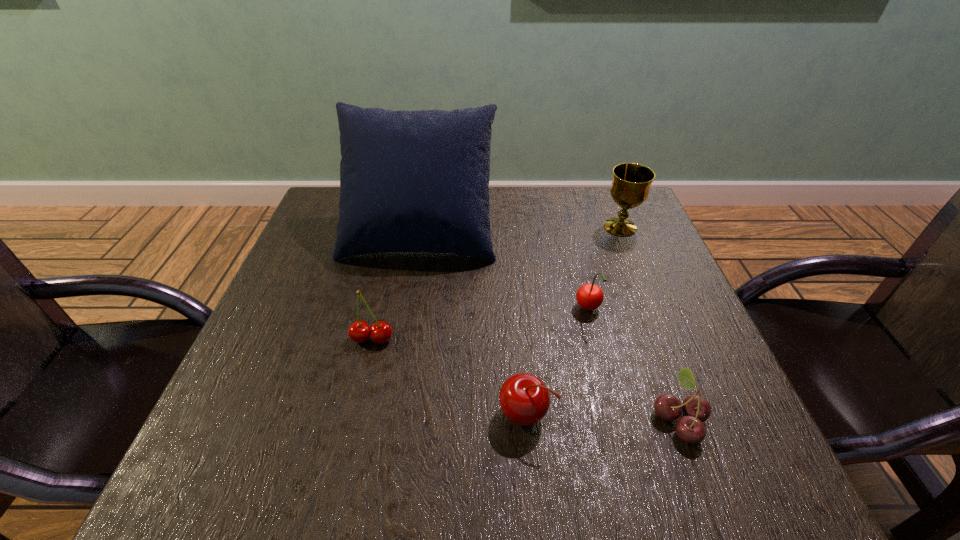
Find the location of a particular element. chalice situated at the right edge is located at coordinates (630, 188).

Where is `cherry that is at the right edge`? The image size is (960, 540). cherry that is at the right edge is located at coordinates (696, 409).

I want to click on object that is at the far left corner, so click(x=410, y=181).

Locate an element on the screen. object located in the far right corner section of the desktop is located at coordinates (630, 188).

In order to click on object present at the near right corner in this screenshot , I will do (x=696, y=409).

Where is `vacant area at the far edge of the desktop`? vacant area at the far edge of the desktop is located at coordinates (553, 233).

In order to click on vacant space at the near edge of the desktop in this screenshot , I will do `click(429, 480)`.

At what (x,y) coordinates should I click in order to perform the action: click on free region at the left edge. Please return your answer as a coordinate pair (x, y). Looking at the image, I should click on (294, 296).

Identify the location of vacant space at the right edge of the desktop. (656, 253).

In the image, there is a desktop. Where is `vacant space at the far left corner`? vacant space at the far left corner is located at coordinates (312, 231).